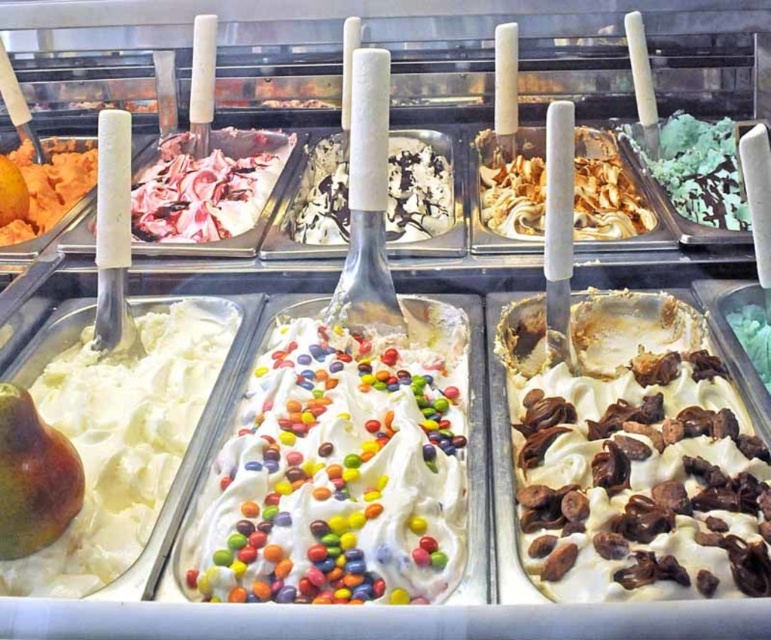
Question: Which of the following is the closest to the observer?

Choices:
 (A) white creamy ice cream with colorful candies at center
 (B) whipped cream with chocolate chips at center

Answer: (B)

Question: Is whipped cream with chocolate chips at center positioned in front of white creamy ice cream with colorful candies at center?

Choices:
 (A) no
 (B) yes

Answer: (B)

Question: Which object is positioned closest to the white creamy ice cream with colorful candies at center?

Choices:
 (A) white creamy ice cream at left
 (B) whipped cream with chocolate chips at center

Answer: (A)

Question: Which point is farther to the camera?

Choices:
 (A) whipped cream with chocolate chips at center
 (B) white creamy ice cream at left
 (C) white creamy ice cream with colorful candies at center

Answer: (B)

Question: Is whipped cream with chocolate chips at center smaller than white creamy ice cream at left?

Choices:
 (A) yes
 (B) no

Answer: (B)

Question: Can you confirm if whipped cream with chocolate chips at center is positioned above white creamy ice cream at left?

Choices:
 (A) yes
 (B) no

Answer: (A)